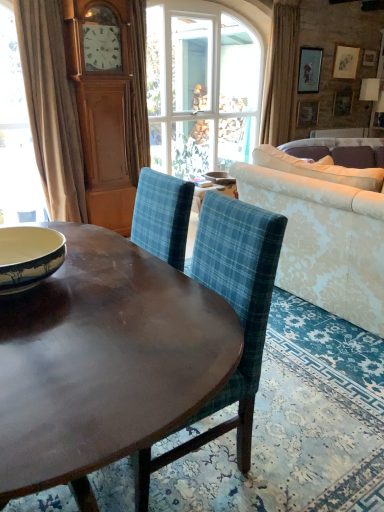
I want to click on empty space that is ontop of shiny brown wood coffee table at center (from a real-world perspective), so click(101, 304).